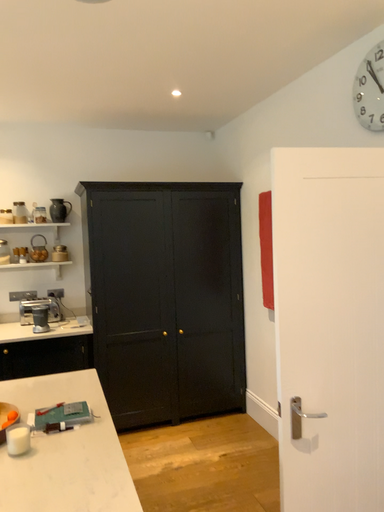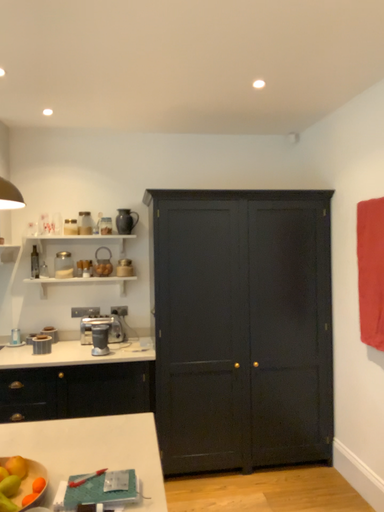
Question: Which way did the camera rotate in the video?

Choices:
 (A) rotated left
 (B) rotated right

Answer: (A)